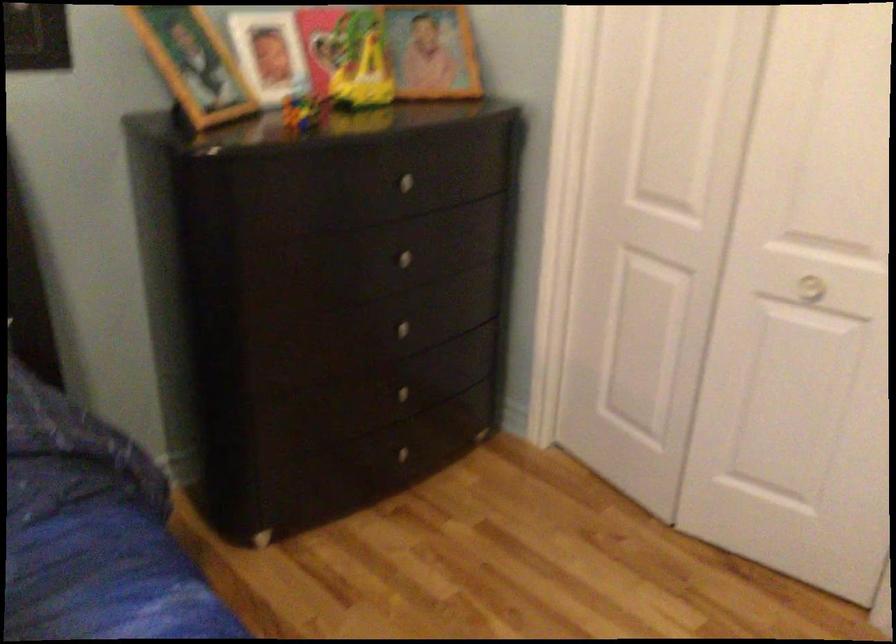
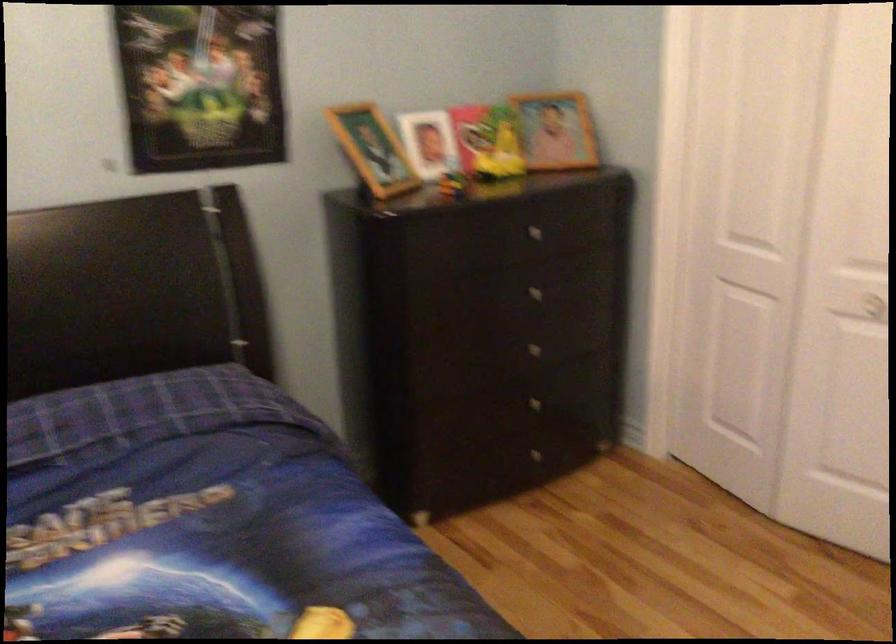
Locate, in the second image, the point that corresponds to the point at 410,261 in the first image.

(538, 292)